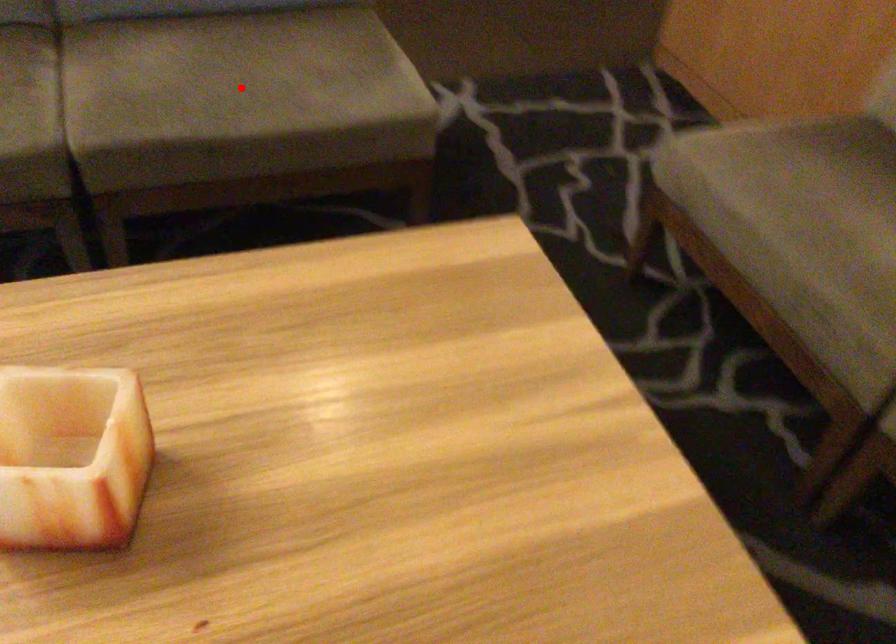
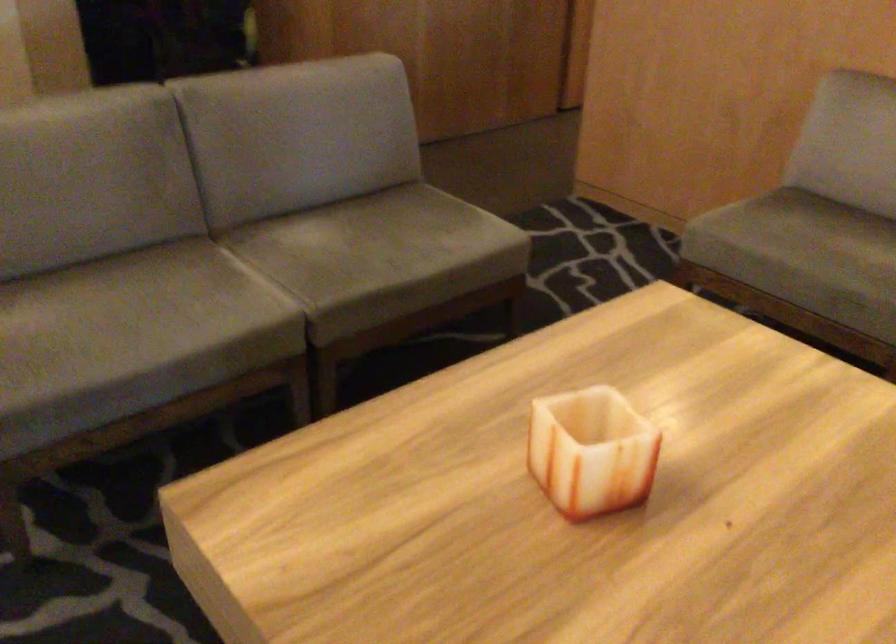
Locate, in the second image, the point that corresponds to the highlighted location in the first image.

(385, 247)